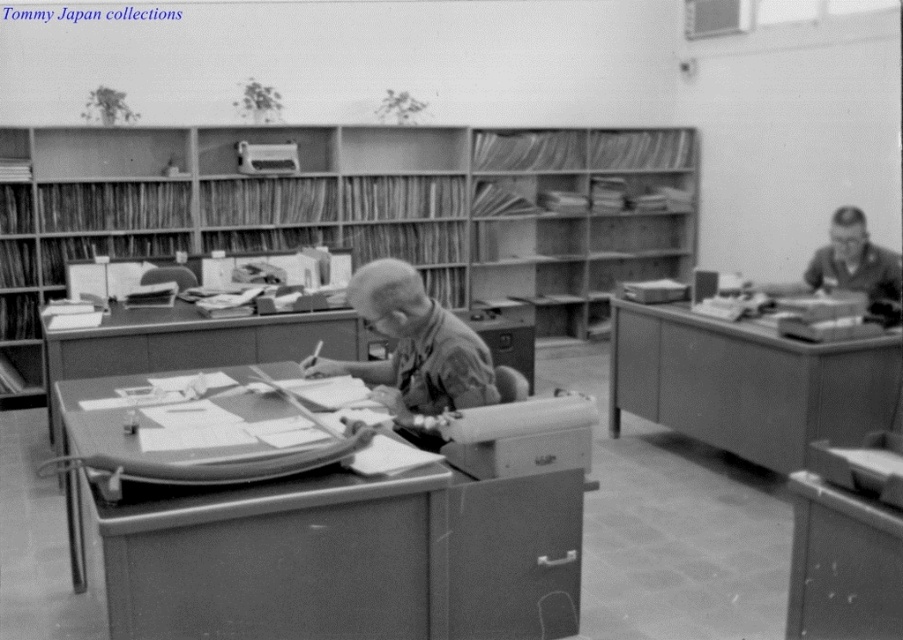
You are organizing a small exhibition and need to place a large sculpture that requires a sturdy surface. You have two options in the image, the wooden shelves at center and the smooth wood table at right. Based on their sizes, which one is more likely to support the sculpture without wobbling?

The wooden shelves at center has a larger size compared to smooth wood table at right, so it is more likely to support the sculpture without wobbling due to its greater stability from being larger.